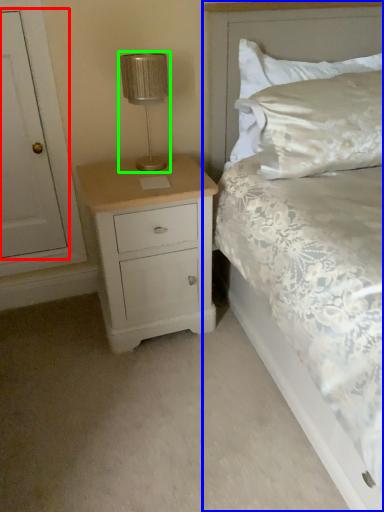
Question: Which object is positioned closest to door (highlighted by a red box)? Select from bed (highlighted by a blue box) and table lamp (highlighted by a green box).

Choices:
 (A) bed
 (B) table lamp

Answer: (B)